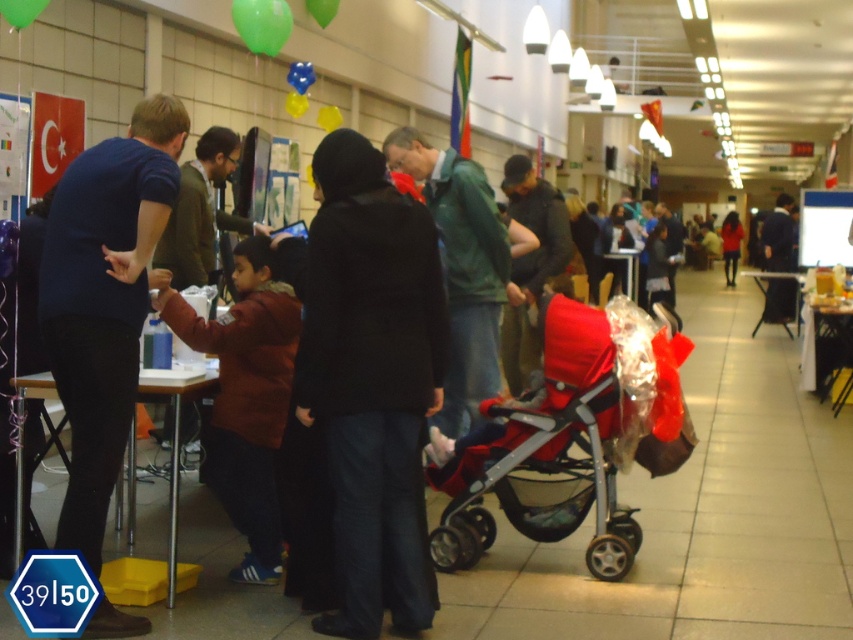
Question: Estimate the real-world distances between objects in this image. Which object is closer to the matte yellow balloon at upper center?

Choices:
 (A) green matte jacket at center
 (B) red fabric baby carriage at center
 (C) translucent blue balloon at upper center
 (D) green rubber balloon at upper center

Answer: (C)

Question: Which is farther from the green matte balloon at upper left?

Choices:
 (A) red matte coat at center
 (B) green matte jacket at center

Answer: (A)

Question: Does black matte coat at center appear under green rubber balloon at upper center?

Choices:
 (A) no
 (B) yes

Answer: (B)

Question: Is blue matte shirt at left below green matte jacket at center?

Choices:
 (A) no
 (B) yes

Answer: (B)

Question: Which point is closer to the camera?

Choices:
 (A) (250, 3)
 (B) (335, 358)
 (C) (788, 212)
 (D) (328, 109)

Answer: (B)

Question: Does blue matte shirt at left appear on the left side of green matte balloon at upper center?

Choices:
 (A) yes
 (B) no

Answer: (A)